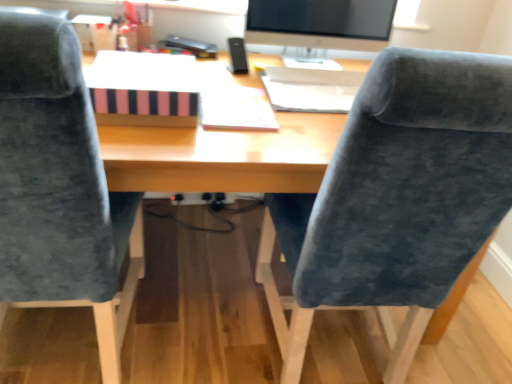
Question: Is satin black monitor at upper center bigger than white paper at center?

Choices:
 (A) yes
 (B) no

Answer: (A)

Question: From the image's perspective, does satin black monitor at upper center appear higher than white paper at center?

Choices:
 (A) yes
 (B) no

Answer: (A)

Question: Can you confirm if satin black monitor at upper center is wider than white paper at center?

Choices:
 (A) yes
 (B) no

Answer: (B)

Question: Can you confirm if satin black monitor at upper center is smaller than white paper at center?

Choices:
 (A) yes
 (B) no

Answer: (B)

Question: Does satin black monitor at upper center have a lesser height compared to white paper at center?

Choices:
 (A) yes
 (B) no

Answer: (B)

Question: Can you confirm if satin black monitor at upper center is positioned to the right of white paper at center?

Choices:
 (A) no
 (B) yes

Answer: (B)

Question: From a real-world perspective, is pink striped paper at center, positioned as the second book in right-to-left order, beneath white paper at upper center, which ranks as the second book in left-to-right order?

Choices:
 (A) yes
 (B) no

Answer: (B)

Question: Can you confirm if pink striped paper at center, positioned as the second book in right-to-left order, is taller than white paper at upper center, which ranks as the second book in left-to-right order?

Choices:
 (A) yes
 (B) no

Answer: (A)

Question: From a real-world perspective, is pink striped paper at center, positioned as the second book in right-to-left order, over white paper at upper center, positioned as the 1th book in right-to-left order?

Choices:
 (A) yes
 (B) no

Answer: (A)

Question: Does pink striped paper at center, positioned as the second book in right-to-left order, lie behind white paper at upper center, which ranks as the second book in left-to-right order?

Choices:
 (A) no
 (B) yes

Answer: (A)

Question: Can white paper at upper center, positioned as the 1th book in right-to-left order, be found inside pink striped paper at center, positioned as the first book in left-to-right order?

Choices:
 (A) no
 (B) yes

Answer: (A)

Question: Is pink striped paper at center, positioned as the second book in right-to-left order, turned away from white paper at upper center, positioned as the 1th book in right-to-left order?

Choices:
 (A) yes
 (B) no

Answer: (B)

Question: From the image's perspective, does satin black monitor at upper center appear higher than pink striped paper at center, positioned as the second book in right-to-left order?

Choices:
 (A) yes
 (B) no

Answer: (A)